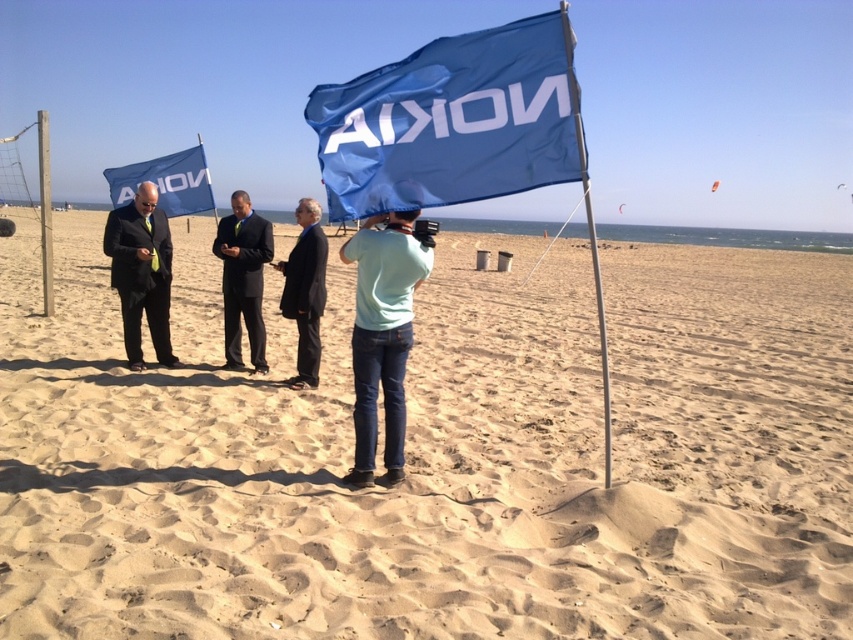
Which is in front, point (434, 109) or point (259, 294)?

Point (434, 109) is more forward.

Who is taller, blue fabric flag at center or dark blue suit at center?

With more height is dark blue suit at center.

Image resolution: width=853 pixels, height=640 pixels. Find the location of `blue fabric flag at center`. blue fabric flag at center is located at coordinates (451, 122).

Does dark blue suit at center have a lesser width compared to blue fabric flagpole at center?

Correct, dark blue suit at center's width is less than blue fabric flagpole at center's.

Is dark blue suit at center closer to the viewer compared to blue fabric flagpole at center?

No, it is not.

What do you see at coordinates (242, 280) in the screenshot? The image size is (853, 640). I see `dark blue suit at center` at bounding box center [242, 280].

I want to click on dark blue suit at center, so [x=242, y=280].

Is point (374, 307) closer to viewer compared to point (306, 356)?

Yes, it is in front of point (306, 356).

Which is behind, point (360, 266) or point (316, 362)?

The point (316, 362) is more distant.

Image resolution: width=853 pixels, height=640 pixels. I want to click on light blue cotton shirt at center, so click(x=381, y=333).